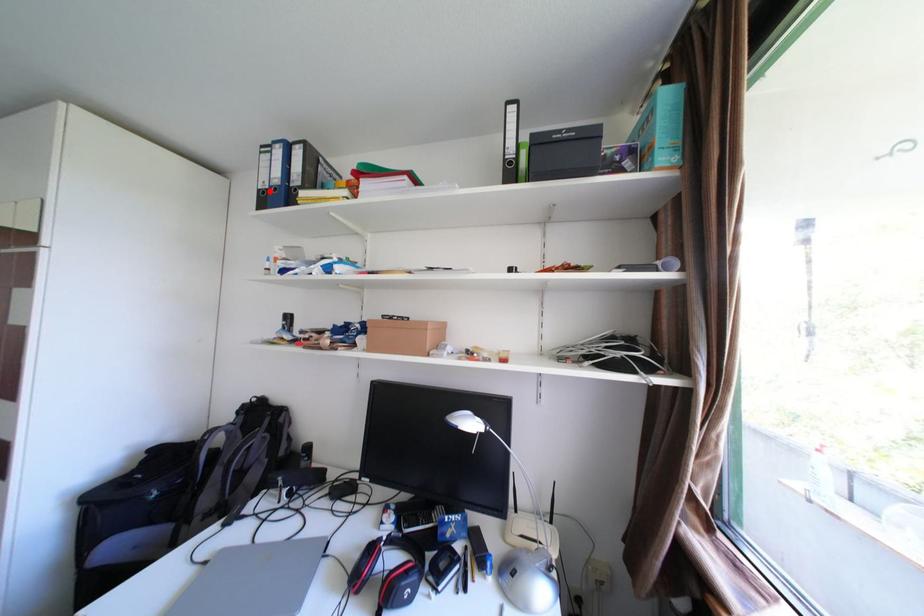
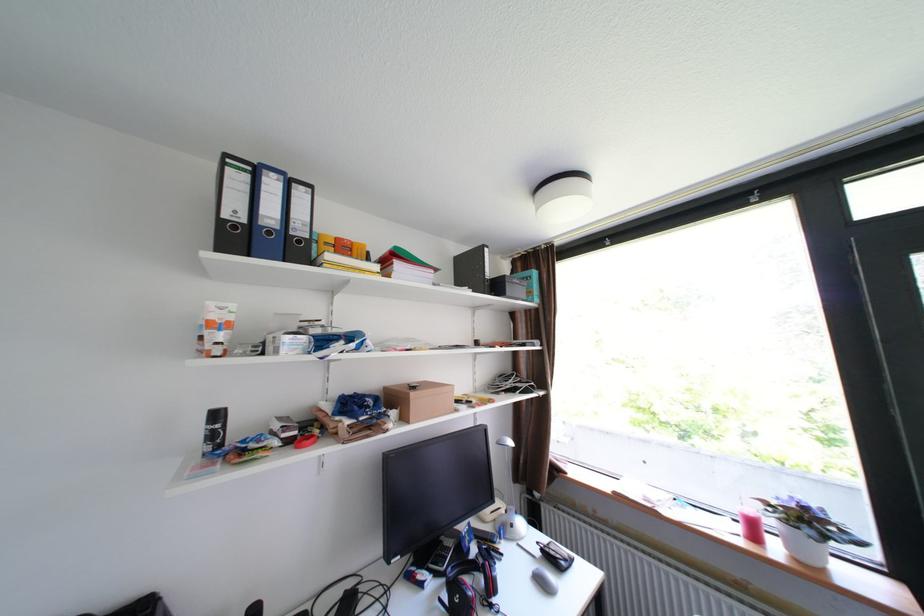
Find the pixel in the second image that matches the highlighted location in the first image.

(232, 221)